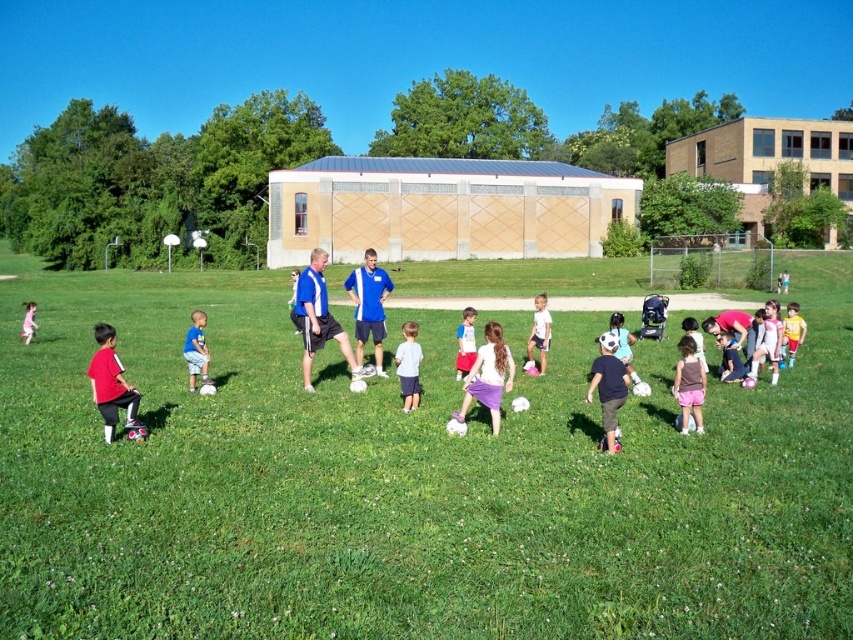
Does purple satin skirt at center have a greater height compared to white cotton shirt at center?

Incorrect, purple satin skirt at center's height is not larger of white cotton shirt at center's.

Is purple satin skirt at center smaller than white cotton shirt at center?

Indeed, purple satin skirt at center has a smaller size compared to white cotton shirt at center.

Does point (503, 344) come closer to viewer compared to point (456, 353)?

That is True.

Identify the location of purple satin skirt at center. Image resolution: width=853 pixels, height=640 pixels. (488, 376).

Can you confirm if matte white soccer ball at center is bigger than blue jersey at center?

Actually, matte white soccer ball at center might be smaller than blue jersey at center.

Which is in front, point (532, 324) or point (289, 307)?

Point (532, 324) is in front.

This screenshot has width=853, height=640. Identify the location of matte white soccer ball at center. (538, 332).

Between white cotton shirt at center and blue jersey at center, which one appears on the right side from the viewer's perspective?

white cotton shirt at center

The height and width of the screenshot is (640, 853). In order to click on white cotton shirt at center in this screenshot , I will do `click(465, 342)`.

Locate an element on the screen. white cotton shirt at center is located at coordinates (465, 342).

You are a GUI agent. You are given a task and a screenshot of the screen. Output one action in this format:
    pyautogui.click(x=<x>, y=<y>)
    Task: Click on the white cotton shirt at center
    Image resolution: width=853 pixels, height=640 pixels.
    Given the screenshot: What is the action you would take?
    pyautogui.click(x=465, y=342)